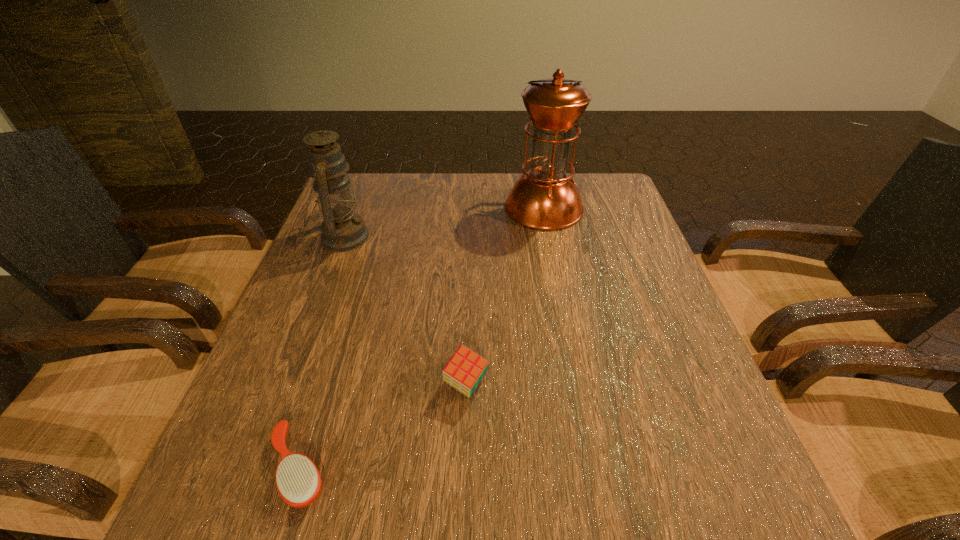
The image size is (960, 540). What are the coordinates of `vacant space at the left edge` in the screenshot? It's located at click(x=347, y=311).

The width and height of the screenshot is (960, 540). What are the coordinates of `vacant space at the right edge` in the screenshot? It's located at (656, 281).

I want to click on vacant space at the near left corner of the desktop, so click(266, 528).

Where is `unoccupied area between the shortest object and the second nearest object`? This screenshot has height=540, width=960. unoccupied area between the shortest object and the second nearest object is located at coordinates (382, 426).

Identify the location of unoccupied position between the tallest object and the hairbrush. The width and height of the screenshot is (960, 540). (421, 338).

Locate an element on the screen. This screenshot has width=960, height=540. free space that is in between the rightmost object and the cube is located at coordinates point(505,296).

At what (x,y) coordinates should I click in order to perform the action: click on free space that is in between the nearest object and the second tallest object. Please return your answer as a coordinate pair (x, y). Looking at the image, I should click on (321, 352).

I want to click on vacant space that's between the hairbrush and the shorter oil lamp, so click(x=321, y=352).

Locate an element on the screen. The image size is (960, 540). vacant space in between the tallest object and the second shortest object is located at coordinates (505, 296).

Where is `vacant space in between the taller oil lamp and the third farthest object`? vacant space in between the taller oil lamp and the third farthest object is located at coordinates (505, 296).